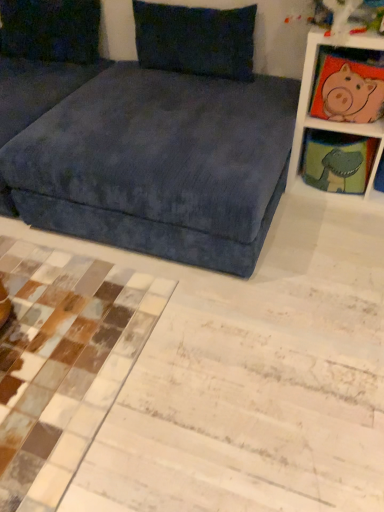
Identify the location of free space in front of white wood shelf at upper right, marked as the second shelf in a bottom-to-top arrangement. This screenshot has width=384, height=512. (333, 230).